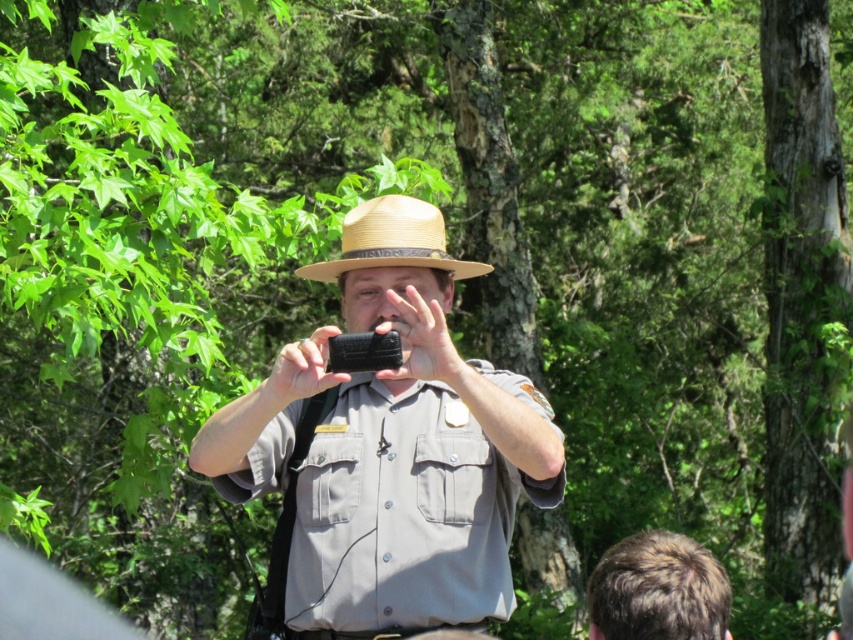
The man in the scene is taking a photo. He wants to ensure that both the brown hair at lower right and the natural straw cowboy hat at center are visible in the frame. Based on their positions, will both objects be visible in the photo?

The brown hair at lower right is in front of the natural straw cowboy hat at center, so both objects will be visible in the photo as the hair is in front but not blocking the entire hat.

What is located at the coordinates point [392,445] in the image?

The point [392,445] marks the gray matte uniform at center.

You are standing in a forest and see a person wearing a gray matte uniform at center and a natural straw cowboy hat at center. Which item is closer to you?

The gray matte uniform at center is closer to the viewer than the natural straw cowboy hat at center.